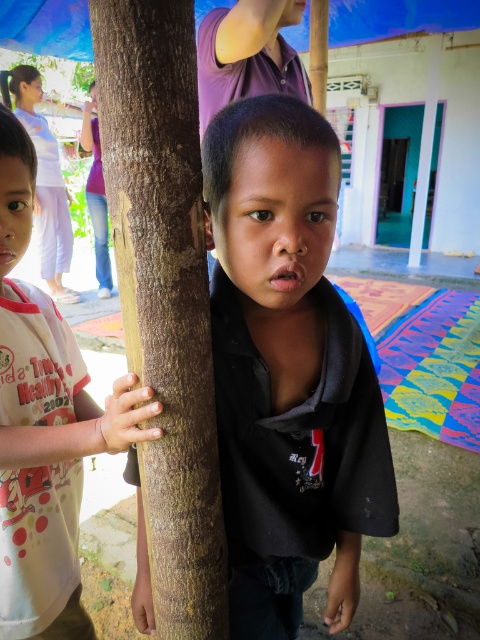
Question: Among these objects, which one is farthest from the camera?

Choices:
 (A) brown rough tree trunk at center
 (B) light pink fabric shirt at left

Answer: (B)

Question: Does black matte shirt at center appear over light pink fabric shirt at left?

Choices:
 (A) no
 (B) yes

Answer: (A)

Question: Which is nearer to the light pink fabric shirt at left?

Choices:
 (A) brown rough tree trunk at center
 (B) black matte shirt at center
 (C) purple smooth shirt at upper center

Answer: (A)

Question: Which of the following is the farthest from the observer?

Choices:
 (A) (3, 435)
 (B) (393, 484)
 (C) (278, 38)
 (D) (190, 189)

Answer: (C)

Question: Is brown rough tree trunk at center above purple smooth shirt at upper center?

Choices:
 (A) no
 (B) yes

Answer: (A)

Question: Can you confirm if brown rough tree trunk at center is wider than purple smooth shirt at upper center?

Choices:
 (A) no
 (B) yes

Answer: (A)